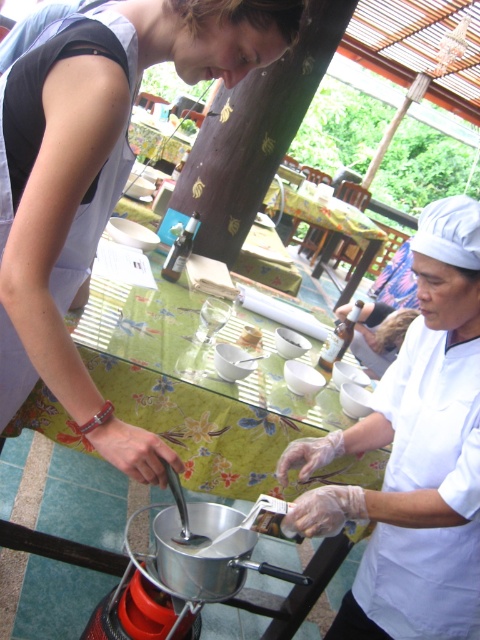
Is matte white chef hat at upper right to the left of white glossy chef hat at upper right from the viewer's perspective?

Correct, you'll find matte white chef hat at upper right to the left of white glossy chef hat at upper right.

Which is behind, point (122, 141) or point (396, 452)?

The point (396, 452) is more distant.

Locate an element on the screen. matte white chef hat at upper right is located at coordinates (103, 172).

In order to click on matte white chef hat at upper right in this screenshot , I will do `click(103, 172)`.

Who is positioned more to the left, matte white chef hat at upper right or white matte bowl at center?

From the viewer's perspective, matte white chef hat at upper right appears more on the left side.

Who is higher up, matte white chef hat at upper right or white matte bowl at center?

matte white chef hat at upper right is higher up.

Between point (55, 163) and point (239, 336), which one is positioned in front?

Positioned in front is point (55, 163).

This screenshot has width=480, height=640. Identify the location of matte white chef hat at upper right. (103, 172).

How much distance is there between white glossy chef hat at upper right and white matte bowl at center?

white glossy chef hat at upper right and white matte bowl at center are 26.29 inches apart.

Does white glossy chef hat at upper right have a larger size compared to white matte bowl at center?

Indeed, white glossy chef hat at upper right has a larger size compared to white matte bowl at center.

Identify the location of white glossy chef hat at upper right. (415, 456).